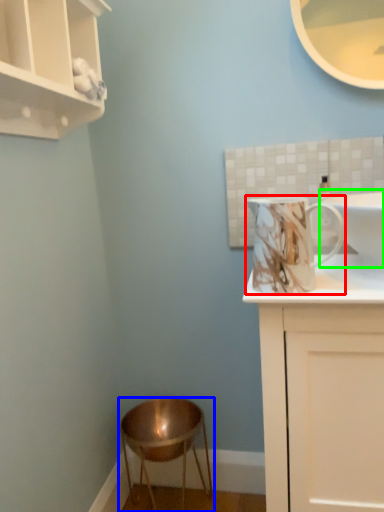
Question: Based on their relative distances, which object is nearer to mug (highlighted by a red box)? Choose from stool (highlighted by a blue box) and sink (highlighted by a green box).

Choices:
 (A) stool
 (B) sink

Answer: (B)